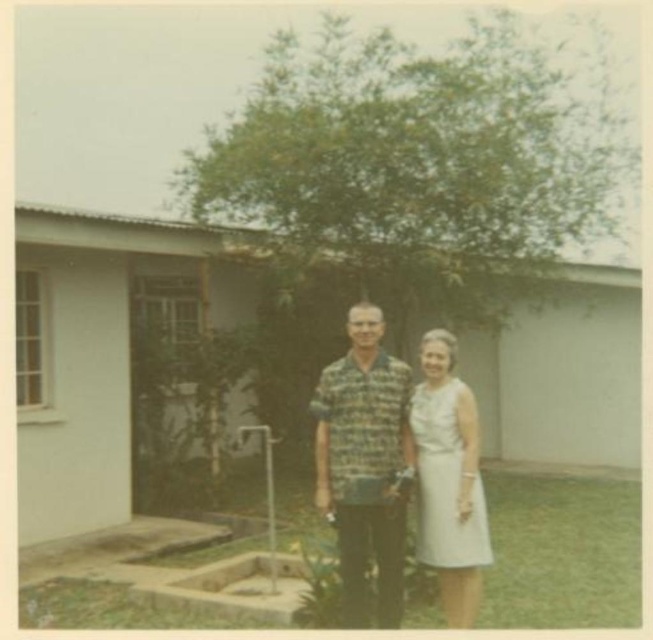
You are a photographer analyzing this vintage image. You notice two central items of clothing, the printed cotton shirt at center and the white satin dress at center. Which piece of clothing is positioned higher in the image?

The printed cotton shirt at center is above the white satin dress at center, so the printed cotton shirt at center is positioned higher in the image.

You are a photographer analyzing this vintage image. You notice two central items of clothing, the printed cotton shirt at center and the white satin dress at center. Which one is positioned more to the left?

The printed cotton shirt at center is positioned more to the left than the white satin dress at center.